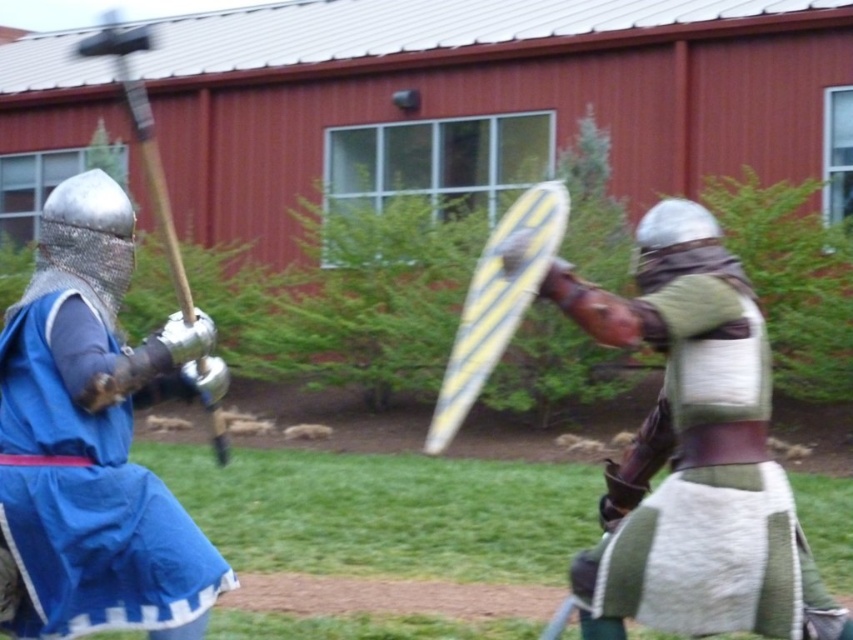
Question: Which of the following is the closest to the observer?

Choices:
 (A) shiny blue tunic at left
 (B) wooden polished mace at left
 (C) green woolen tunic at center

Answer: (C)

Question: Can you confirm if green woolen tunic at center is positioned above shiny blue tunic at left?

Choices:
 (A) yes
 (B) no

Answer: (B)

Question: Estimate the real-world distances between objects in this image. Which object is closer to the shiny blue tunic at left?

Choices:
 (A) wooden polished mace at left
 (B) green woolen tunic at center

Answer: (B)

Question: Estimate the real-world distances between objects in this image. Which object is farther from the green woolen tunic at center?

Choices:
 (A) wooden polished mace at left
 (B) shiny blue tunic at left

Answer: (A)

Question: Does shiny blue tunic at left appear under wooden polished mace at left?

Choices:
 (A) yes
 (B) no

Answer: (A)

Question: Can you confirm if green woolen tunic at center is bigger than shiny blue tunic at left?

Choices:
 (A) no
 (B) yes

Answer: (B)